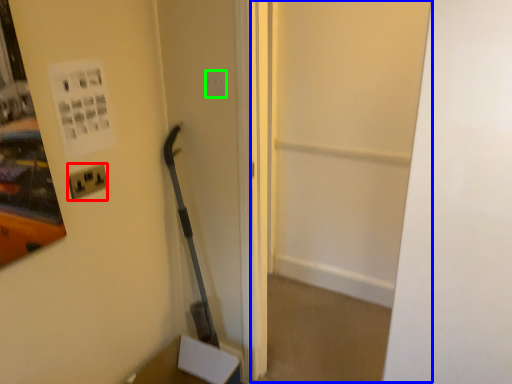
Question: Which is nearer to the electric outlet (highlighted by a red box)? glass door (highlighted by a blue box) or light switch (highlighted by a green box).

Choices:
 (A) glass door
 (B) light switch

Answer: (B)